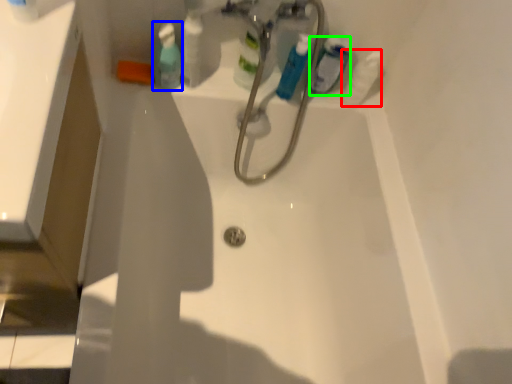
Question: Which is nearer to the cleaning product (highlighted by a red box)? mouthwash (highlighted by a blue box) or mouthwash (highlighted by a green box).

Choices:
 (A) mouthwash
 (B) mouthwash

Answer: (B)